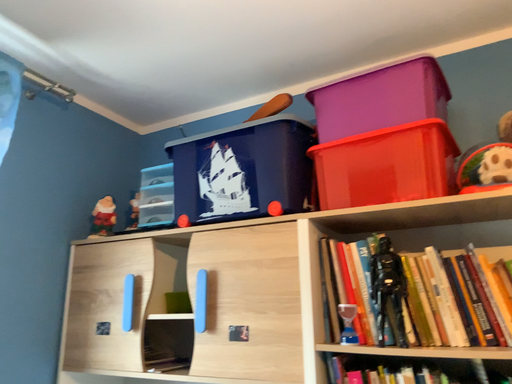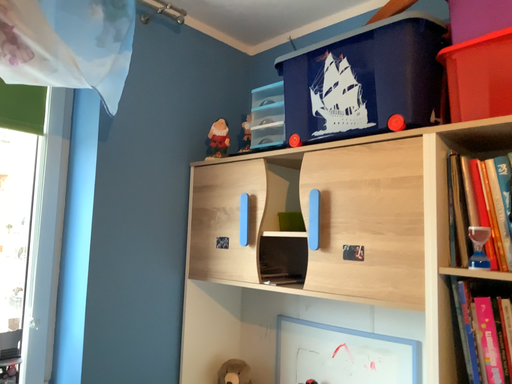
Question: Which way did the camera rotate in the video?

Choices:
 (A) rotated left
 (B) rotated right

Answer: (A)